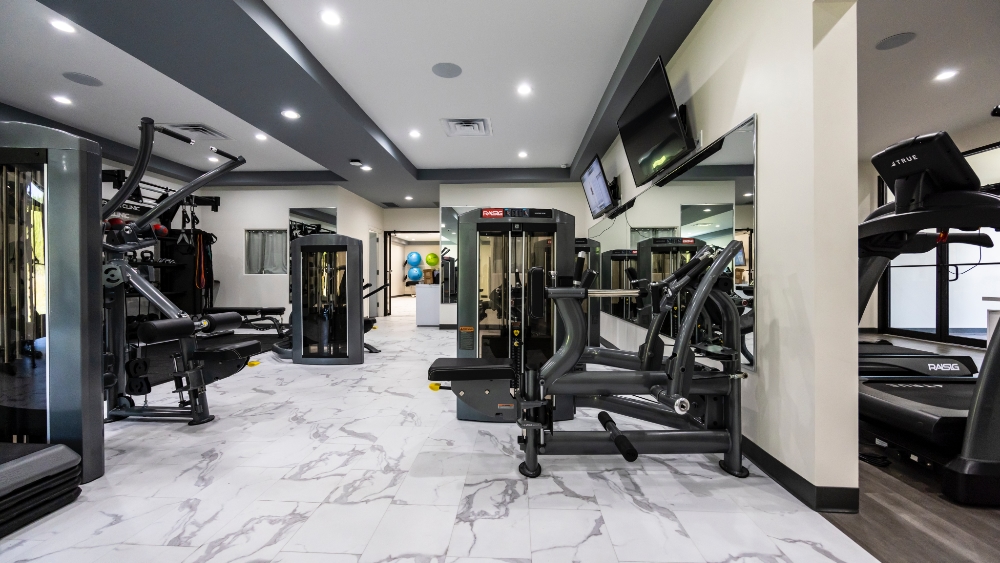
The height and width of the screenshot is (563, 1000). In order to click on floor in this screenshot , I will do `click(342, 455)`.